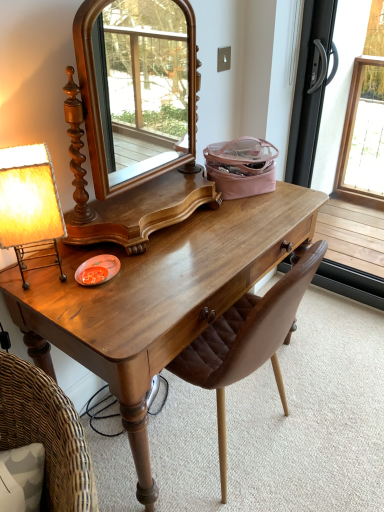
At what (x,y) coordinates should I click in order to perform the action: click on vacant space behind matte yellow fabric lampshade at left. Please return your answer as a coordinate pair (x, y). Image resolution: width=384 pixels, height=512 pixels. Looking at the image, I should click on (69, 250).